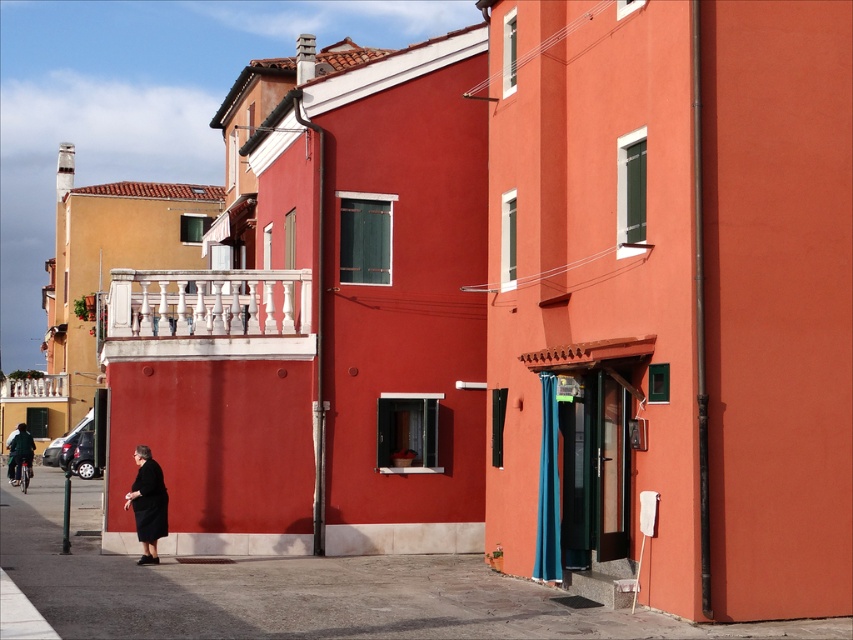
Which of these two, smooth concrete pavement at lower center or dark green fabric jacket at lower left, stands shorter?

Standing shorter between the two is smooth concrete pavement at lower center.

Between point (44, 538) and point (20, 452), which one is positioned behind?

The point (20, 452) is more distant.

Find the location of a particular element. This screenshot has width=853, height=640. smooth concrete pavement at lower center is located at coordinates coord(306,593).

Can you confirm if white marble balcony at upper left is positioned above dark green fabric jacket at lower left?

Indeed, white marble balcony at upper left is positioned over dark green fabric jacket at lower left.

Can you confirm if white marble balcony at upper left is shorter than dark green fabric jacket at lower left?

Indeed, white marble balcony at upper left has a lesser height compared to dark green fabric jacket at lower left.

Where is `white marble balcony at upper left`? Image resolution: width=853 pixels, height=640 pixels. white marble balcony at upper left is located at coordinates (35, 388).

Does white marble railing at upper left have a larger size compared to black matte dress at lower left?

No.

Is white marble railing at upper left thinner than black matte dress at lower left?

Indeed, white marble railing at upper left has a lesser width compared to black matte dress at lower left.

Is point (213, 291) behind point (149, 468)?

Yes.

This screenshot has height=640, width=853. Find the location of `white marble railing at upper left`. white marble railing at upper left is located at coordinates (207, 314).